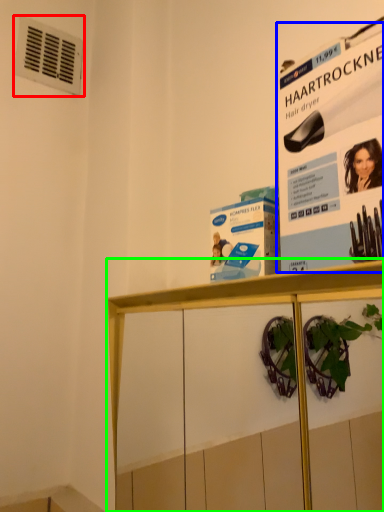
Question: Based on their relative distances, which object is nearer to air conditioning (highlighted by a red box)? Choose from poster page (highlighted by a blue box) and shelf (highlighted by a green box).

Choices:
 (A) poster page
 (B) shelf

Answer: (B)